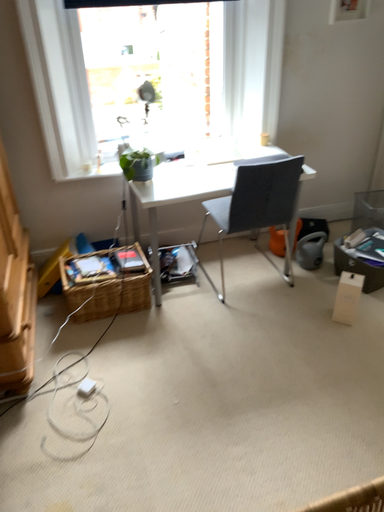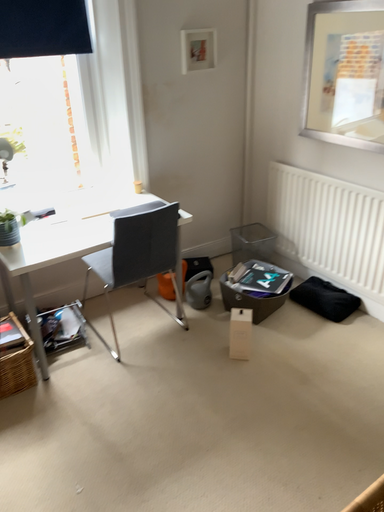
Question: How did the camera likely rotate when shooting the video?

Choices:
 (A) rotated right
 (B) rotated left

Answer: (A)